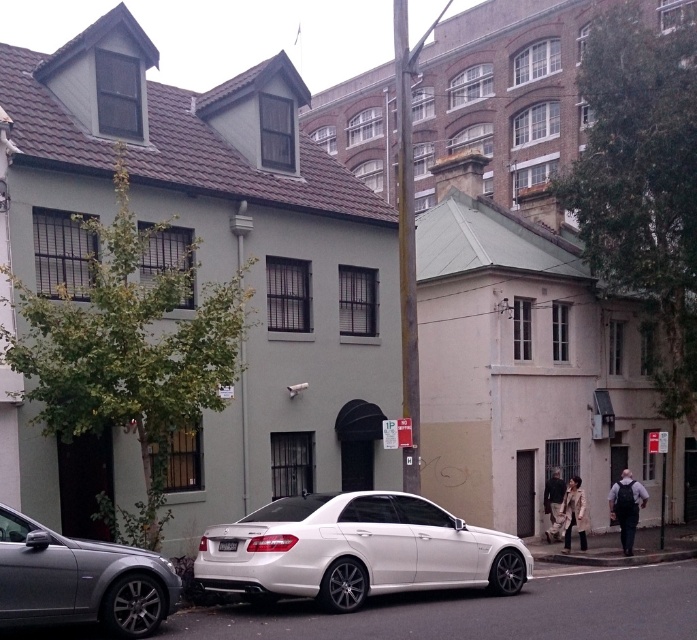
Question: Can you confirm if white metallic car at center is positioned above gray concrete curb at lower center?

Choices:
 (A) yes
 (B) no

Answer: (A)

Question: In this image, where is white metallic car at center located relative to gray concrete curb at lower center?

Choices:
 (A) right
 (B) left

Answer: (B)

Question: Estimate the real-world distances between objects in this image. Which object is closer to the white metallic car at center?

Choices:
 (A) gray concrete curb at lower center
 (B) silver metallic sedan at lower left

Answer: (B)

Question: Which point is closer to the camera?

Choices:
 (A) white metallic car at center
 (B) gray concrete curb at lower center
 (C) silver metallic sedan at lower left

Answer: (C)

Question: Is silver metallic sedan at lower left to the right of gray concrete curb at lower center from the viewer's perspective?

Choices:
 (A) no
 (B) yes

Answer: (A)

Question: Among these points, which one is nearest to the camera?

Choices:
 (A) (116, 598)
 (B) (558, 556)

Answer: (A)